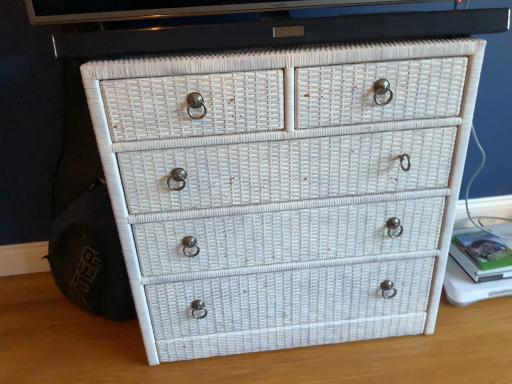
Question: Can you confirm if white wicker drawer at center is thinner than green matte book at right?

Choices:
 (A) no
 (B) yes

Answer: (A)

Question: Does white wicker drawer at center lie in front of green matte book at right?

Choices:
 (A) yes
 (B) no

Answer: (A)

Question: Considering the relative sizes of white wicker drawer at center and green matte book at right in the image provided, is white wicker drawer at center wider than green matte book at right?

Choices:
 (A) yes
 (B) no

Answer: (A)

Question: Can you confirm if white wicker drawer at center is bigger than green matte book at right?

Choices:
 (A) yes
 (B) no

Answer: (A)

Question: Can you confirm if white wicker drawer at center is positioned to the left of green matte book at right?

Choices:
 (A) yes
 (B) no

Answer: (A)

Question: Looking at the image, does green matte book at right seem bigger or smaller compared to white wicker drawer at center?

Choices:
 (A) small
 (B) big

Answer: (A)

Question: Considering the positions of green matte book at right and white wicker drawer at center in the image, is green matte book at right wider or thinner than white wicker drawer at center?

Choices:
 (A) thin
 (B) wide

Answer: (A)

Question: Is point (465, 246) closer or farther from the camera than point (436, 332)?

Choices:
 (A) farther
 (B) closer

Answer: (A)

Question: From a real-world perspective, relative to white wicker drawer at center, is green matte book at right vertically above or below?

Choices:
 (A) below
 (B) above

Answer: (B)

Question: Is white wicker drawer at center in front of or behind green matte book at right in the image?

Choices:
 (A) behind
 (B) front

Answer: (B)

Question: From a real-world perspective, is white wicker drawer at center physically located above or below green matte book at right?

Choices:
 (A) above
 (B) below

Answer: (B)

Question: Does point (409, 349) appear closer or farther from the camera than point (464, 228)?

Choices:
 (A) farther
 (B) closer

Answer: (B)

Question: Is white wicker drawer at center taller or shorter than green matte book at right?

Choices:
 (A) tall
 (B) short

Answer: (A)

Question: Based on their sizes in the image, would you say white wicker chest of drawers at center is bigger or smaller than green matte book at right?

Choices:
 (A) big
 (B) small

Answer: (A)

Question: Considering the positions of white wicker chest of drawers at center and green matte book at right in the image, is white wicker chest of drawers at center wider or thinner than green matte book at right?

Choices:
 (A) thin
 (B) wide

Answer: (B)